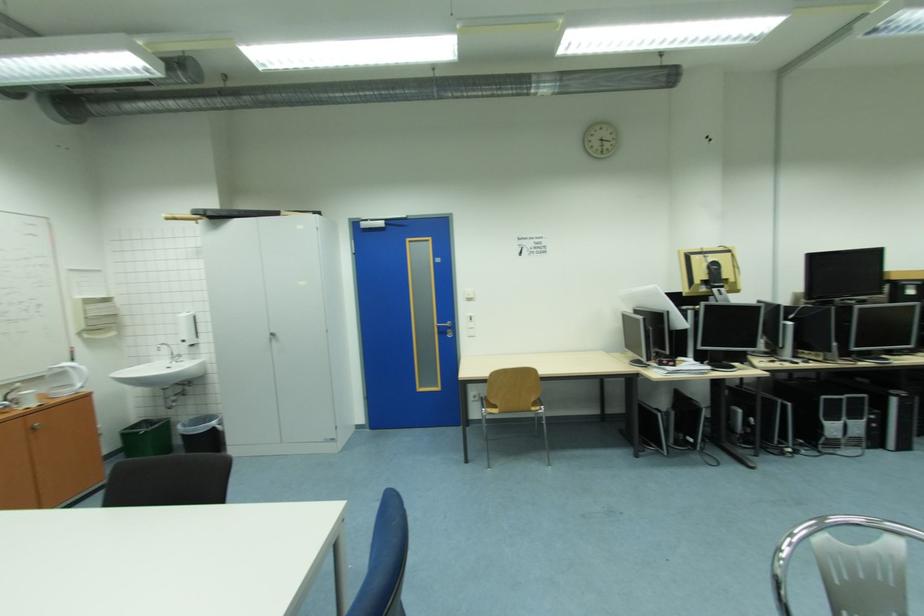
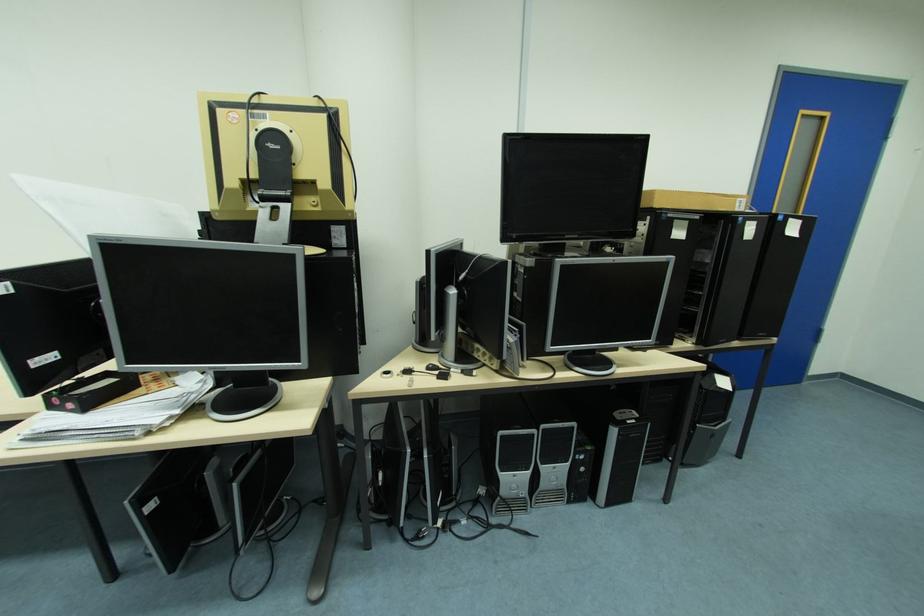
The images are taken continuously from a first-person perspective. In which direction are you moving?

The cameraman walked toward right, forward.